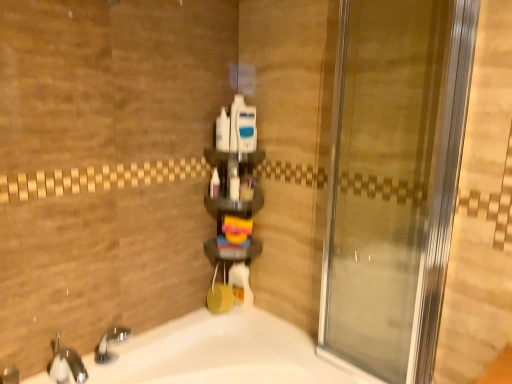
Question: In terms of height, does translucent plastic bottle at center, arranged as the fifth toiletry when viewed from the right, look taller or shorter compared to brushed metal faucet at lower left?

Choices:
 (A) short
 (B) tall

Answer: (B)

Question: Does point (215, 168) appear closer or farther from the camera than point (9, 367)?

Choices:
 (A) closer
 (B) farther

Answer: (B)

Question: Which object is positioned closest to the translucent plastic bottle at center, arranged as the fifth toiletry when viewed from the right?

Choices:
 (A) white glossy bathtub at lower left
 (B) polished chrome faucet at lower left
 (C) white glossy bottle at center, which is counted as the 3th toiletry, starting from the right
 (D) transparent glass door at center
 (E) white plastic bottles at center, placed as the 2th toiletry when sorted from left to right

Answer: (C)

Question: Which is farther from the white plastic bottles at center, placed as the 2th toiletry when sorted from left to right?

Choices:
 (A) translucent plastic bottle at center, which is the 1th toiletry from left to right
 (B) white plastic container at center, the 2th toiletry positioned from the right
 (C) polished chrome faucet at lower left
 (D) blue plastic razor at center, the fifth toiletry from the left
 (E) white glossy bottle at center, positioned as the third toiletry in left-to-right order

Answer: (C)